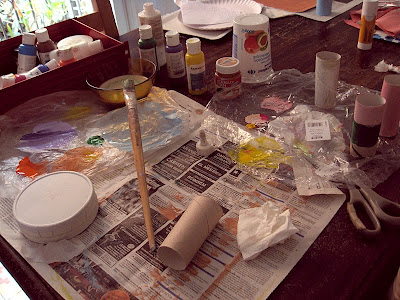
This screenshot has width=400, height=300. Find the location of `toilet paper roll`. toilet paper roll is located at coordinates (194, 226).